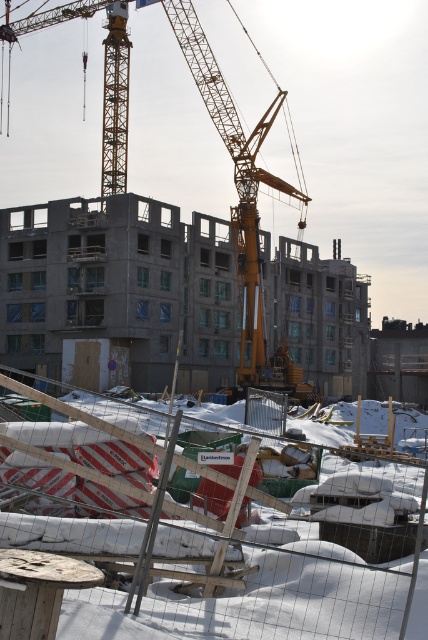
How much distance is there between white plastic fencing at lower center and yellow metallic crane at center?

The distance of white plastic fencing at lower center from yellow metallic crane at center is 49.42 meters.

Is white plastic fencing at lower center shorter than yellow metallic crane at center?

Yes.

Does point (181, 634) lie in front of point (246, 204)?

Yes, point (181, 634) is closer to viewer.

Locate an element on the screen. white plastic fencing at lower center is located at coordinates (204, 531).